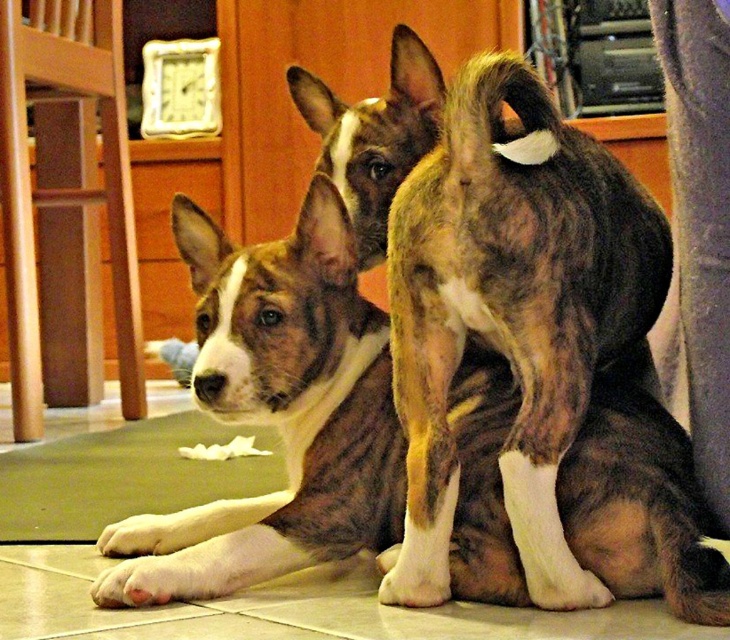
Question: Which object is closer to the camera taking this photo?

Choices:
 (A) brown brindle coat at center
 (B) green fabric mat at lower left

Answer: (A)

Question: Can you confirm if brown brindle fur at center is wider than green fabric mat at lower left?

Choices:
 (A) no
 (B) yes

Answer: (B)

Question: Which of the following is the closest to the observer?

Choices:
 (A) green fabric mat at lower left
 (B) brown brindle fur at center

Answer: (B)

Question: Is brown brindle fur at center below brown brindle coat at center?

Choices:
 (A) no
 (B) yes

Answer: (B)

Question: Which point is closer to the camera?

Choices:
 (A) (118, 470)
 (B) (253, 310)

Answer: (B)

Question: Does brown brindle fur at center appear on the left side of green fabric mat at lower left?

Choices:
 (A) no
 (B) yes

Answer: (A)